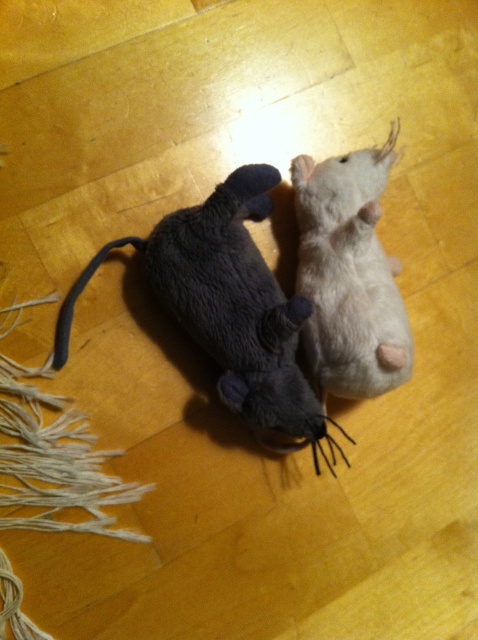
Between dark gray plush mouse at center and white soft toy mouse at upper right, which one appears on the right side from the viewer's perspective?

white soft toy mouse at upper right

Describe the element at coordinates (228, 307) in the screenshot. I see `dark gray plush mouse at center` at that location.

Which is in front, point (256, 298) or point (316, 301)?

Positioned in front is point (256, 298).

Where is `dark gray plush mouse at center`? dark gray plush mouse at center is located at coordinates (228, 307).